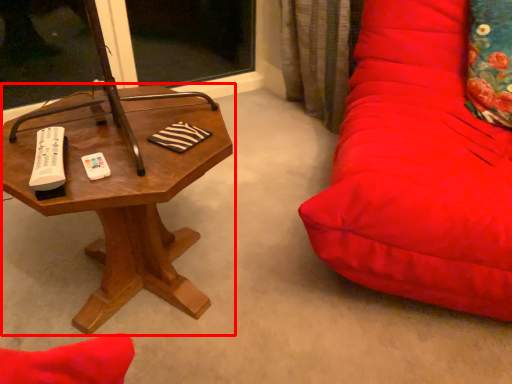
Question: From the image's perspective, where is table (annotated by the red box) located in relation to throw pillow in the image?

Choices:
 (A) below
 (B) above

Answer: (A)